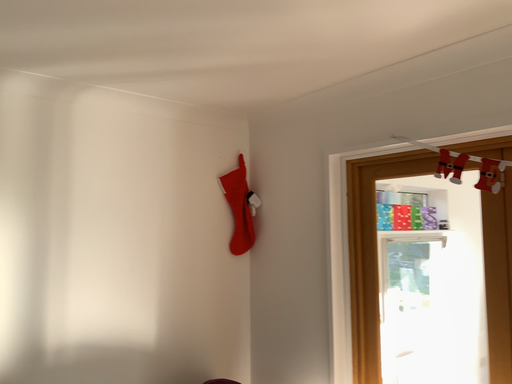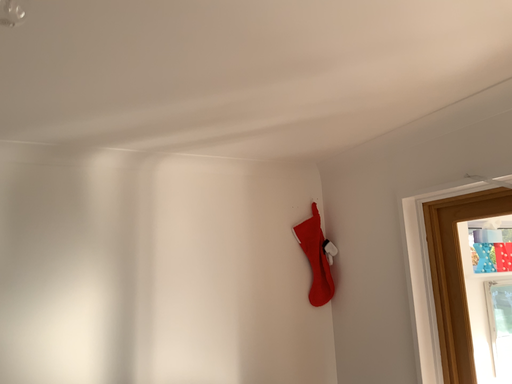
Question: How did the camera likely rotate when shooting the video?

Choices:
 (A) rotated right
 (B) rotated left

Answer: (B)